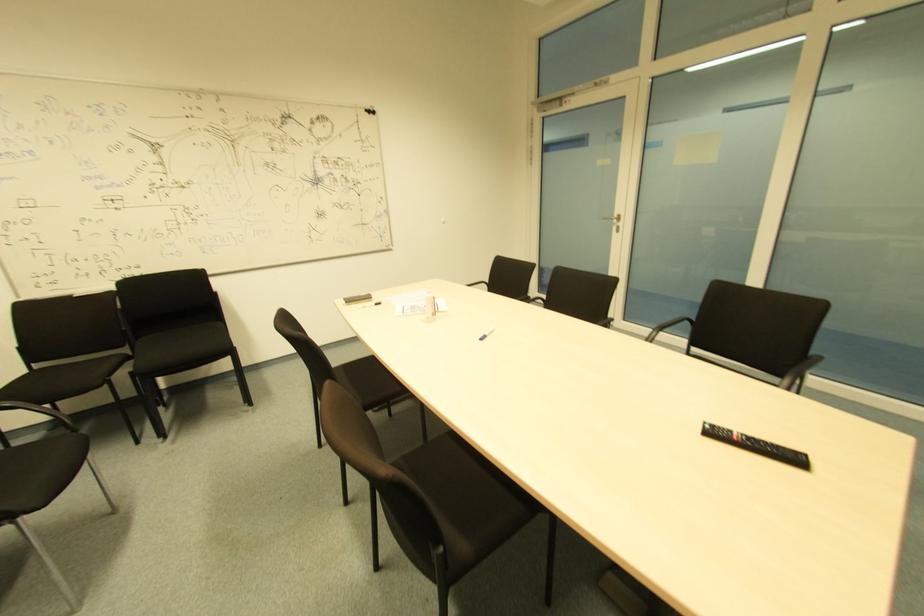
Which object does [485,333] point to?

It corresponds to the whiteboard marker in the image.